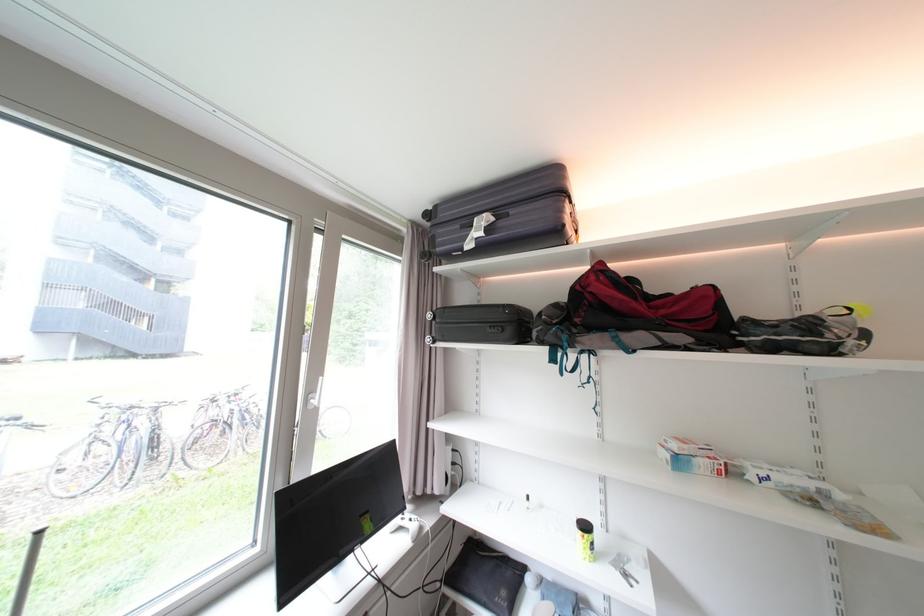
This screenshot has height=616, width=924. Find the location of `black fabric pouch`. black fabric pouch is located at coordinates (484, 578).